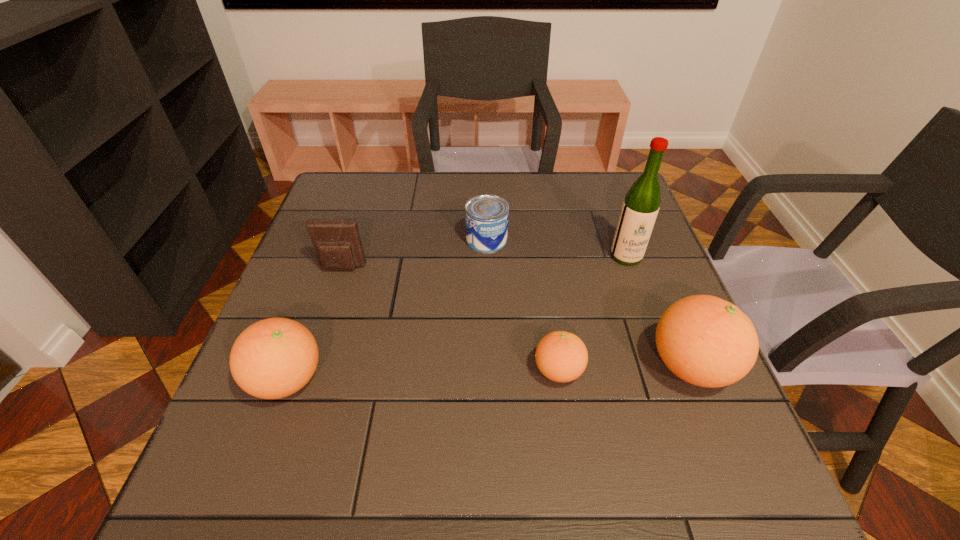
Locate an element on the screen. The height and width of the screenshot is (540, 960). free space between the rightmost orange and the can is located at coordinates (588, 303).

The height and width of the screenshot is (540, 960). I want to click on vacant region between the second orange from left to right and the pouch, so click(x=450, y=320).

Identify the location of free spot between the rightmost orange and the tallest object. (659, 311).

In order to click on vacant space in between the second shortest orange and the tallest object in this screenshot , I will do `click(457, 318)`.

The image size is (960, 540). Identify the location of object that is the third closest to the second orange from right to left. (487, 216).

Locate an element on the screen. This screenshot has width=960, height=540. object that stands as the second closest to the pouch is located at coordinates (487, 216).

Identify the location of orange that is the second closest to the second shortest orange. Image resolution: width=960 pixels, height=540 pixels. (706, 341).

Identify which orange is located as the nearest to the second orange from left to right. Please provide its 2D coordinates. Your answer should be formatted as a tuple, i.e. [(x, y)], where the tuple contains the x and y coordinates of a point satisfying the conditions above.

[(706, 341)]

Image resolution: width=960 pixels, height=540 pixels. In order to click on free spot that satisfies the following two spatial constraints: 1. on the front label of the shortest orange; 2. on the left side of the third object from left to right in this screenshot , I will do `click(489, 371)`.

Where is `free spot that satisfies the following two spatial constraints: 1. on the back side of the third object from right to left; 2. on the right side of the second tallest orange`? The image size is (960, 540). free spot that satisfies the following two spatial constraints: 1. on the back side of the third object from right to left; 2. on the right side of the second tallest orange is located at coordinates (290, 371).